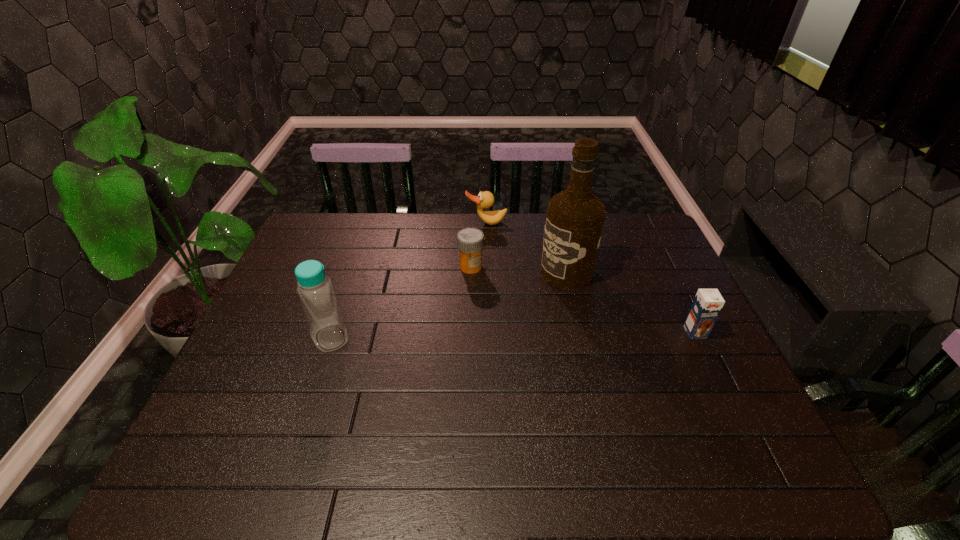
This screenshot has width=960, height=540. What are the coordinates of `free point located on the label of the fourth object from left to right` in the screenshot? It's located at (475, 326).

Locate an element on the screen. The width and height of the screenshot is (960, 540). free space located 0.390m on the label of the fourth object from left to right is located at coordinates (443, 346).

I want to click on blank space located 0.290m on the beak of the duck, so click(x=500, y=283).

At what (x,y) coordinates should I click in order to perform the action: click on vacant area located on the beak of the duck. Please return your answer as a coordinate pair (x, y). The image size is (960, 540). Looking at the image, I should click on (501, 287).

In order to click on vacant space situated 0.390m on the beak of the duck in this screenshot , I will do `click(505, 306)`.

You are a GUI agent. You are given a task and a screenshot of the screen. Output one action in this format:
    pyautogui.click(x=<x>, y=<y>)
    Task: Click on the free location located on the label side of the medicine
    The height and width of the screenshot is (540, 960).
    Given the screenshot: What is the action you would take?
    pyautogui.click(x=465, y=367)

Locate an element on the screen. The height and width of the screenshot is (540, 960). vacant space located on the label side of the medicine is located at coordinates (467, 333).

You are a GUI agent. You are given a task and a screenshot of the screen. Output one action in this format:
    pyautogui.click(x=<x>, y=<y>)
    Task: Click on the free spot located on the label side of the medicine
    The width and height of the screenshot is (960, 540).
    Given the screenshot: What is the action you would take?
    pyautogui.click(x=468, y=317)

Where is `object that is at the far edge`? The width and height of the screenshot is (960, 540). object that is at the far edge is located at coordinates (485, 199).

The width and height of the screenshot is (960, 540). Find the location of `object situated at the right edge`. object situated at the right edge is located at coordinates (707, 304).